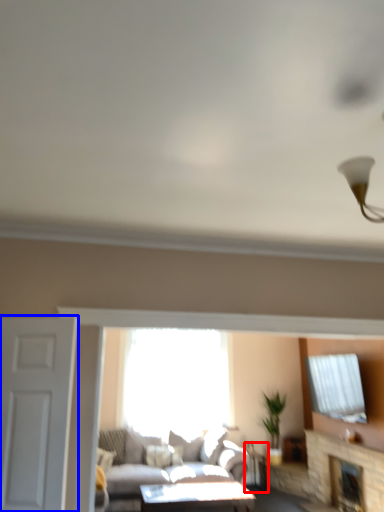
Question: Which object appears closest to the camera in this image, side table (highlighted by a red box) or door (highlighted by a blue box)?

Choices:
 (A) side table
 (B) door

Answer: (B)